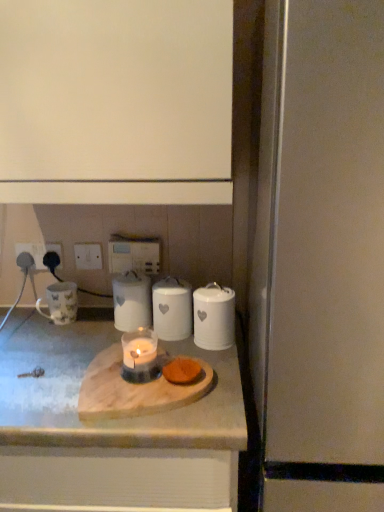
Identify the location of free region under white matte cabinet at upper center (from a real-world perspective). Image resolution: width=384 pixels, height=512 pixels. (77, 341).